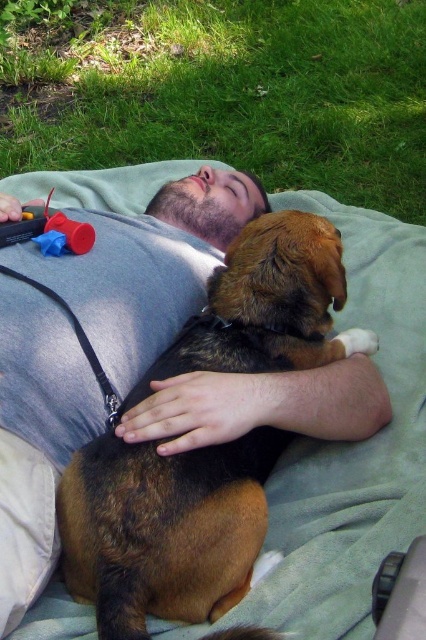
Question: Is green grass at upper center wider than rubberized plastic toy at upper left?

Choices:
 (A) no
 (B) yes

Answer: (B)

Question: Which object is farther from the camera taking this photo?

Choices:
 (A) rubberized plastic toy at upper left
 (B) green grass at upper center

Answer: (B)

Question: Based on their relative distances, which object is nearer to the green grass at upper center?

Choices:
 (A) rubberized plastic toy at upper left
 (B) brown fur dog at center

Answer: (B)

Question: Which point is farther to the camera?

Choices:
 (A) brown fur dog at center
 (B) green grass at upper center
 (C) rubberized plastic toy at upper left

Answer: (B)

Question: From the image, what is the correct spatial relationship of green grass at upper center in relation to rubberized plastic toy at upper left?

Choices:
 (A) above
 (B) below

Answer: (A)

Question: Is green grass at upper center wider than rubberized plastic toy at upper left?

Choices:
 (A) yes
 (B) no

Answer: (A)